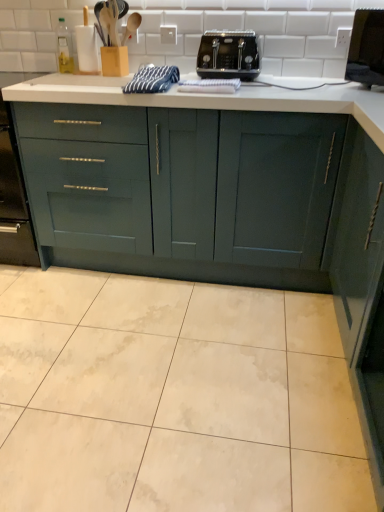
Question: Is blue striped towel at center to the left of teal matte cabinet at center, acting as the first cabinetry starting from the left, from the viewer's perspective?

Choices:
 (A) no
 (B) yes

Answer: (B)

Question: Considering the relative positions of blue striped towel at center and teal matte cabinet at center, which appears as the 2th cabinetry when viewed from the right, in the image provided, is blue striped towel at center to the right of teal matte cabinet at center, which appears as the 2th cabinetry when viewed from the right, from the viewer's perspective?

Choices:
 (A) yes
 (B) no

Answer: (B)

Question: From a real-world perspective, is blue striped towel at center below teal matte cabinet at center, acting as the first cabinetry starting from the left?

Choices:
 (A) no
 (B) yes

Answer: (A)

Question: Is blue striped towel at center not inside teal matte cabinet at center, which appears as the 2th cabinetry when viewed from the right?

Choices:
 (A) no
 (B) yes

Answer: (B)

Question: From the image's perspective, would you say blue striped towel at center is shown under teal matte cabinet at center, which appears as the 2th cabinetry when viewed from the right?

Choices:
 (A) no
 (B) yes

Answer: (A)

Question: Choose the correct answer: Is teal matte cabinet at center, which appears as the 2th cabinetry when viewed from the right, inside blue striped towel at center or outside it?

Choices:
 (A) outside
 (B) inside

Answer: (A)

Question: From the image's perspective, is teal matte cabinet at center, which appears as the 2th cabinetry when viewed from the right, located above or below blue striped towel at center?

Choices:
 (A) below
 (B) above

Answer: (A)

Question: Is teal matte cabinet at center, which appears as the 2th cabinetry when viewed from the right, taller or shorter than blue striped towel at center?

Choices:
 (A) short
 (B) tall

Answer: (B)

Question: Considering their positions, is teal matte cabinet at center, which appears as the 2th cabinetry when viewed from the right, located in front of or behind blue striped towel at center?

Choices:
 (A) front
 (B) behind

Answer: (A)

Question: From a real-world perspective, relative to blue striped towel at center, is black plastic toaster at center vertically above or below?

Choices:
 (A) below
 (B) above

Answer: (B)

Question: From the image's perspective, relative to blue striped towel at center, is black plastic toaster at center above or below?

Choices:
 (A) below
 (B) above

Answer: (B)

Question: In terms of width, does black plastic toaster at center look wider or thinner when compared to blue striped towel at center?

Choices:
 (A) thin
 (B) wide

Answer: (A)

Question: Would you say black plastic toaster at center is to the left or to the right of blue striped towel at center in the picture?

Choices:
 (A) right
 (B) left

Answer: (A)

Question: Looking at their shapes, would you say blue striped towel at center is wider or thinner than black plastic toaster at center?

Choices:
 (A) thin
 (B) wide

Answer: (B)

Question: From the image's perspective, is blue striped towel at center located above or below black plastic toaster at center?

Choices:
 (A) above
 (B) below

Answer: (B)